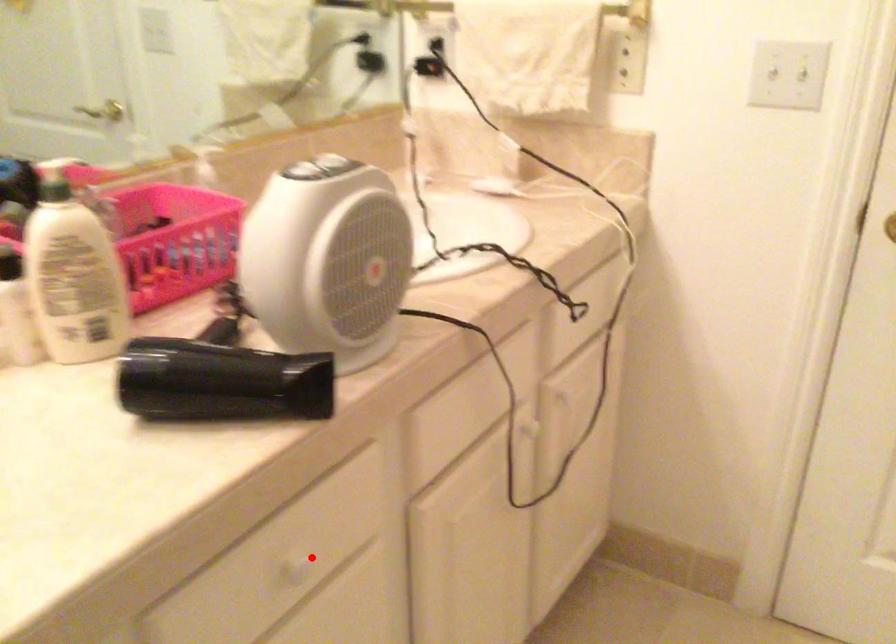
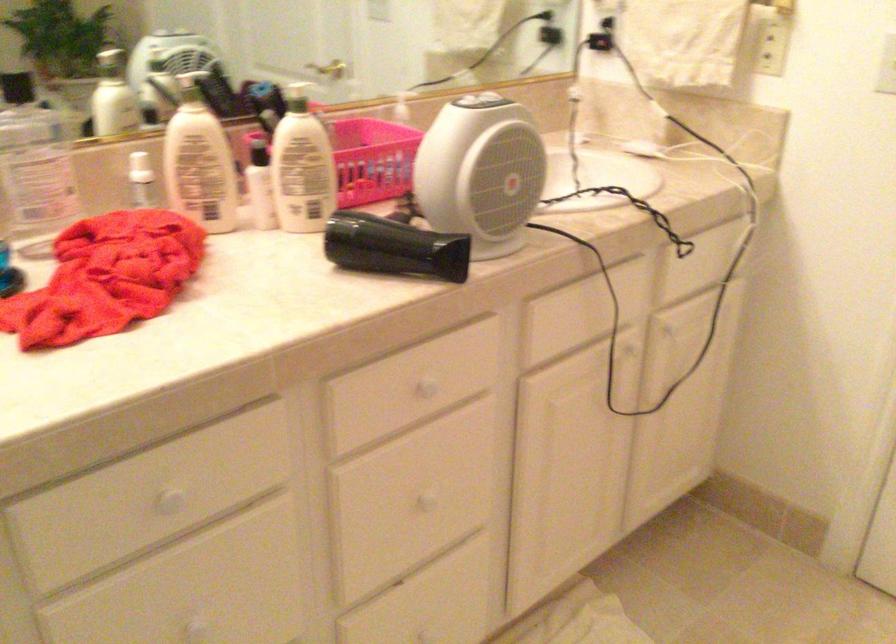
Question: I am providing you with two images of the same scene from different viewpoints. Given a red point in image1, look at the same physical point in image2. Is it:

Choices:
 (A) Closer to the viewpoint
 (B) Farther from the viewpoint

Answer: (B)